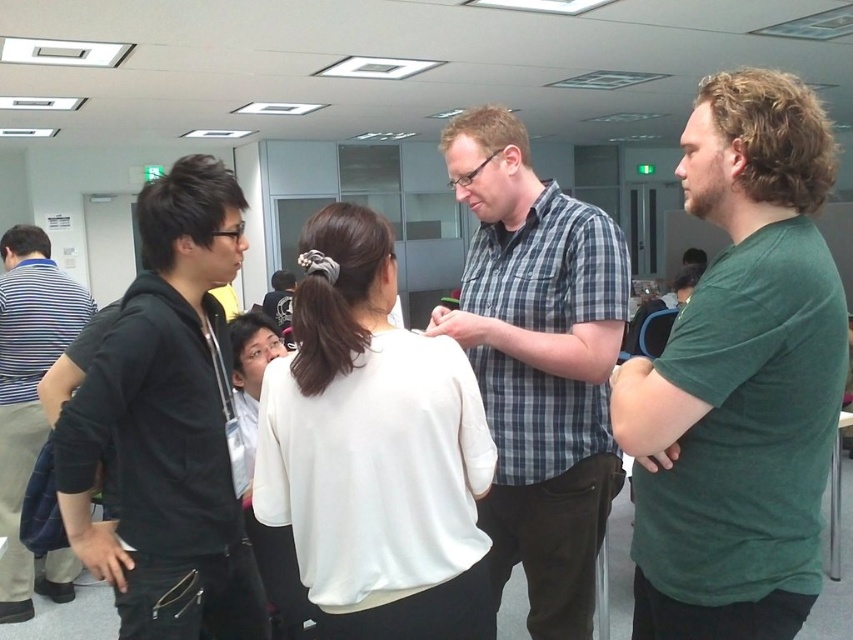
Question: Which object is the closest to the black hoodie at left?

Choices:
 (A) plaid shirt at center
 (B) white matte shirt at center
 (C) striped cotton shirt at left

Answer: (B)

Question: Among these points, which one is farthest from the camera?

Choices:
 (A) (816, 321)
 (B) (544, 401)
 (C) (322, 378)
 (D) (12, 552)

Answer: (D)

Question: Is green matte shirt at right closer to the viewer compared to striped cotton shirt at left?

Choices:
 (A) no
 (B) yes

Answer: (B)

Question: Which is farther from the striped cotton shirt at left?

Choices:
 (A) black hoodie at left
 (B) white matte shirt at center

Answer: (B)

Question: Is green matte shirt at right positioned behind striped cotton shirt at left?

Choices:
 (A) no
 (B) yes

Answer: (A)

Question: From the image, what is the correct spatial relationship of white matte shirt at center in relation to plaid shirt at center?

Choices:
 (A) above
 (B) below

Answer: (B)